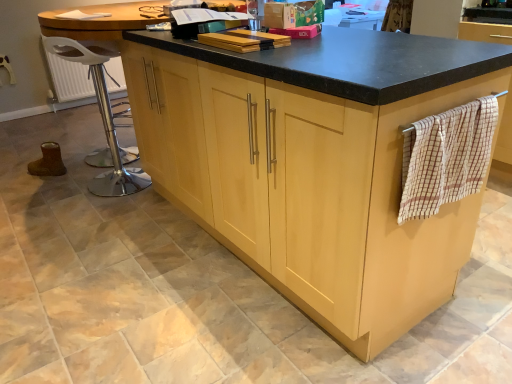
At what (x,y) coordinates should I click in order to perform the action: click on beige checkered towel at right. Please return your answer as a coordinate pair (x, y). Looking at the image, I should click on (446, 157).

What do you see at coordinates (102, 117) in the screenshot?
I see `metallic silver bar stool at left` at bounding box center [102, 117].

At what (x,y) coordinates should I click in order to perform the action: click on light wood cabinetry at center. Please return your answer as a coordinate pair (x, y). This screenshot has height=384, width=512. Looking at the image, I should click on (314, 164).

Which of these two, metallic silver bar stool at left or beige checkered towel at right, is bigger?

Bigger between the two is metallic silver bar stool at left.

From a real-world perspective, between metallic silver bar stool at left and beige checkered towel at right, who is vertically higher?

From a 3D spatial view, beige checkered towel at right is above.

Which object is positioned more to the left, metallic silver bar stool at left or beige checkered towel at right?

Positioned to the left is metallic silver bar stool at left.

How far apart are metallic silver bar stool at left and beige checkered towel at right?

They are 5.59 feet apart.

Is beige checkered towel at right to the right of light wood cabinetry at center from the viewer's perspective?

Indeed, beige checkered towel at right is positioned on the right side of light wood cabinetry at center.

Where is `blanket above the light wood cabinetry at center (from a real-world perspective)`? This screenshot has height=384, width=512. blanket above the light wood cabinetry at center (from a real-world perspective) is located at coordinates (446, 157).

Consider the image. Can you tell me how much beige checkered towel at right and light wood cabinetry at center differ in facing direction?

The angular difference between beige checkered towel at right and light wood cabinetry at center is 3.53e-05 degrees.

Considering the positions of objects beige checkered towel at right and light wood cabinetry at center in the image provided, who is behind, beige checkered towel at right or light wood cabinetry at center?

beige checkered towel at right.

From the image's perspective, does beige checkered towel at right appear higher than metallic silver bar stool at left?

Actually, beige checkered towel at right appears below metallic silver bar stool at left in the image.

Is beige checkered towel at right not inside metallic silver bar stool at left?

That's correct, beige checkered towel at right is outside of metallic silver bar stool at left.

Is beige checkered towel at right at the right side of metallic silver bar stool at left?

Yes.

Does beige checkered towel at right have a larger size compared to metallic silver bar stool at left?

No, beige checkered towel at right is not bigger than metallic silver bar stool at left.

What's the angular difference between light wood cabinetry at center and metallic silver bar stool at left's facing directions?

21.2 degrees.

Locate an element on the screen. bar stool that appears below the light wood cabinetry at center (from a real-world perspective) is located at coordinates (102, 117).

Choose the correct answer: Is light wood cabinetry at center inside metallic silver bar stool at left or outside it?

light wood cabinetry at center is not enclosed by metallic silver bar stool at left.

Looking at their sizes, would you say light wood cabinetry at center is wider or thinner than metallic silver bar stool at left?

In the image, light wood cabinetry at center appears to be wider than metallic silver bar stool at left.

Is light wood cabinetry at center located outside beige checkered towel at right?

Absolutely, light wood cabinetry at center is external to beige checkered towel at right.

Between light wood cabinetry at center and beige checkered towel at right, which one has smaller width?

Thinner between the two is beige checkered towel at right.

Is light wood cabinetry at center beside beige checkered towel at right?

No, light wood cabinetry at center is not beside beige checkered towel at right.

Is light wood cabinetry at center positioned with its back to beige checkered towel at right?

No, beige checkered towel at right is not at the back of light wood cabinetry at center.

Is metallic silver bar stool at left positioned with its back to light wood cabinetry at center?

metallic silver bar stool at left does not have its back to light wood cabinetry at center.

Between metallic silver bar stool at left and light wood cabinetry at center, which one has larger size?

light wood cabinetry at center.

Between metallic silver bar stool at left and light wood cabinetry at center, which one is positioned in front?

light wood cabinetry at center.

Are metallic silver bar stool at left and light wood cabinetry at center located far from each other?

metallic silver bar stool at left is positioned a significant distance from light wood cabinetry at center.

You are a GUI agent. You are given a task and a screenshot of the screen. Output one action in this format:
    pyautogui.click(x=<x>, y=<y>)
    Task: Click on the bar stool on the left of the beige checkered towel at right
    The width and height of the screenshot is (512, 384).
    Given the screenshot: What is the action you would take?
    pyautogui.click(x=102, y=117)

Where is `blanket that is behind the light wood cabinetry at center`? blanket that is behind the light wood cabinetry at center is located at coordinates (446, 157).

Based on the photo, considering their positions, is metallic silver bar stool at left positioned closer to light wood cabinetry at center than beige checkered towel at right?

beige checkered towel at right is closer to light wood cabinetry at center.

Based on their spatial positions, is beige checkered towel at right or metallic silver bar stool at left further from light wood cabinetry at center?

The object further to light wood cabinetry at center is metallic silver bar stool at left.

Considering their positions, is metallic silver bar stool at left positioned closer to beige checkered towel at right than light wood cabinetry at center?

The object closer to beige checkered towel at right is light wood cabinetry at center.

From the image, which object appears to be nearer to metallic silver bar stool at left, beige checkered towel at right or light wood cabinetry at center?

The object closer to metallic silver bar stool at left is light wood cabinetry at center.

Looking at this image, from the image, which object appears to be farther from beige checkered towel at right, light wood cabinetry at center or metallic silver bar stool at left?

Among the two, metallic silver bar stool at left is located further to beige checkered towel at right.

From the image, which object appears to be nearer to metallic silver bar stool at left, light wood cabinetry at center or beige checkered towel at right?

light wood cabinetry at center is closer to metallic silver bar stool at left.

At what (x,y) coordinates should I click in order to perform the action: click on cabinetry between metallic silver bar stool at left and beige checkered towel at right from left to right. Please return your answer as a coordinate pair (x, y). The width and height of the screenshot is (512, 384). Looking at the image, I should click on (314, 164).